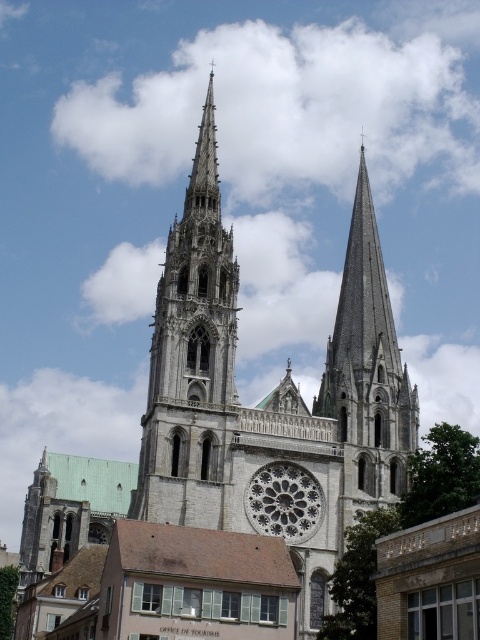
Looking at this image, you are standing at a distance from the cathedral and want to know how far you are from the point marked at coordinates point (226, 67). Can you determine the distance?

The distance between point (226, 67) and the viewer is 176.83 meters.

You are standing at the entrance of the cathedral facing the facade. There are two points marked on the facade. The first point is at coordinates point (225, 156) and the second is at point (264, 509). Which point is closer to you?

Point (264, 509) is closer to you because it is in front of point (225, 156).